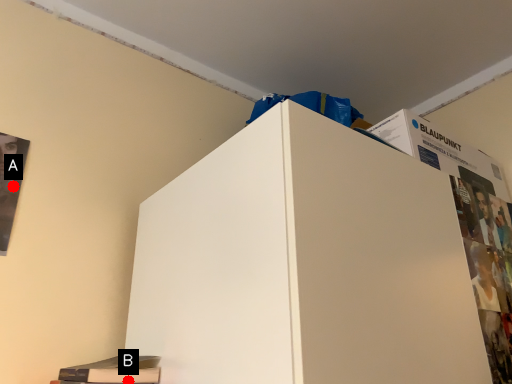
Question: Two points are circled on the image, labeled by A and B beside each circle. Among these points, which one is nearest to the camera?

Choices:
 (A) A is closer
 (B) B is closer

Answer: (B)